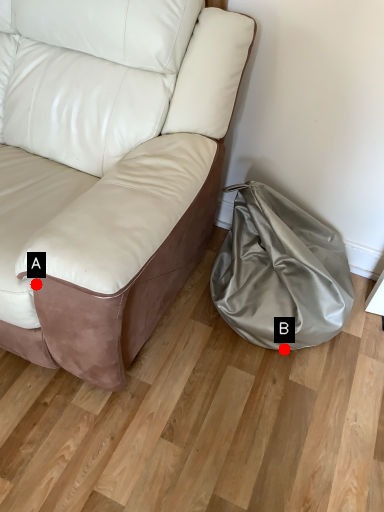
Question: Two points are circled on the image, labeled by A and B beside each circle. Which point is farther to the camera?

Choices:
 (A) A is further
 (B) B is further

Answer: (B)